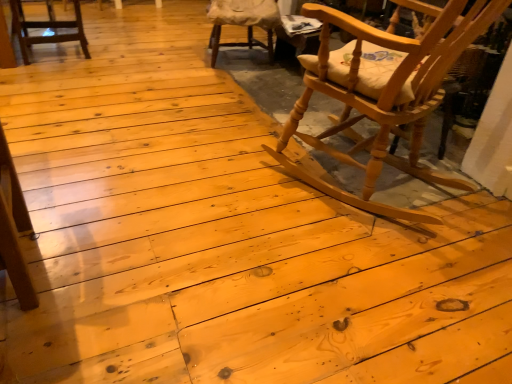
Identify the location of free space to the left of wooden cushioned chair at upper center, positioned as the second chair in right-to-left order. (164, 52).